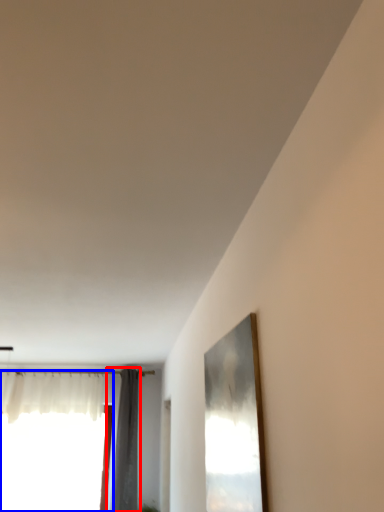
Question: Which of the following is the farthest to the observer, curtain (highlighted by a red box) or window (highlighted by a blue box)?

Choices:
 (A) curtain
 (B) window

Answer: (B)